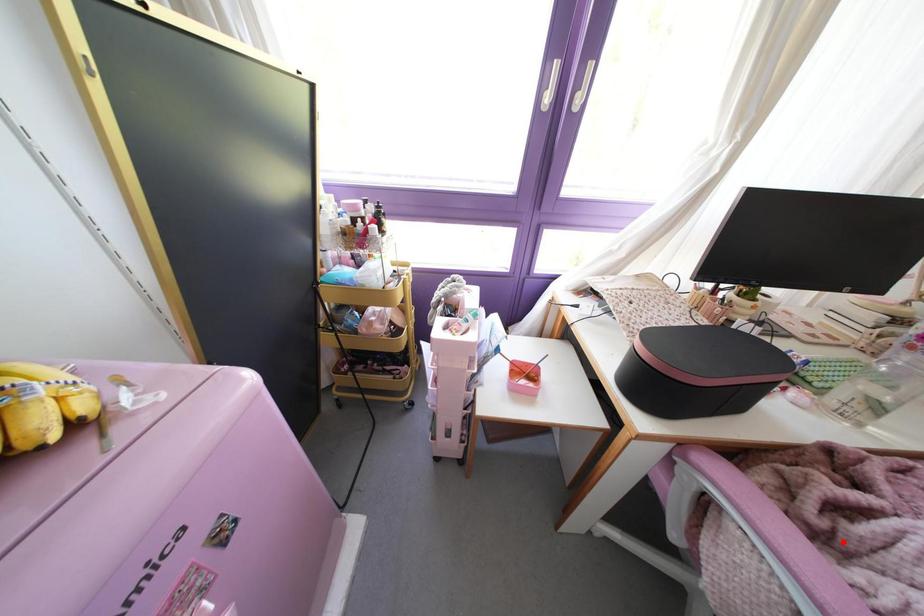
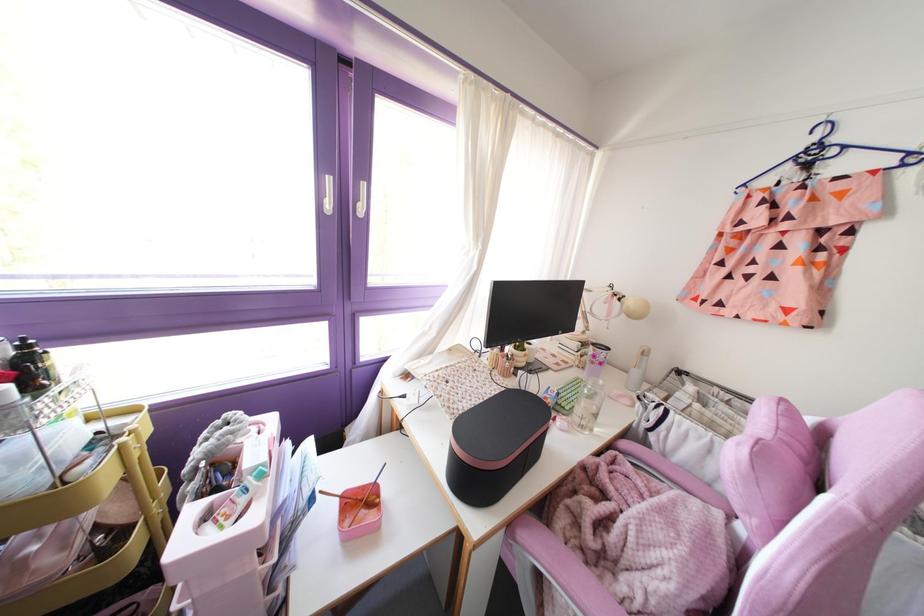
Question: I am providing you with two images of the same scene from different viewpoints. A red point is marked on the first image. At the location where the point appears in image 1, is it still visible in image 2?

Choices:
 (A) Yes
 (B) No

Answer: (A)